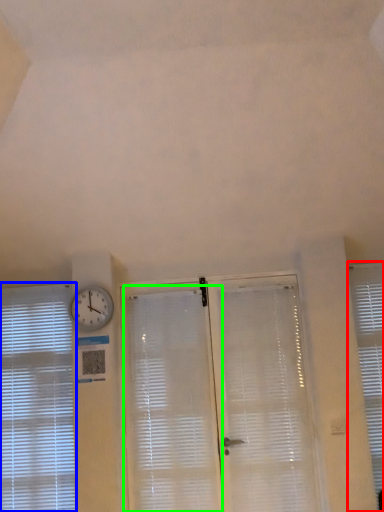
Question: Estimate the real-world distances between objects in this image. Which object is farther from window blind (highlighted by a red box), window blind (highlighted by a blue box) or shutter (highlighted by a green box)?

Choices:
 (A) window blind
 (B) shutter

Answer: (A)